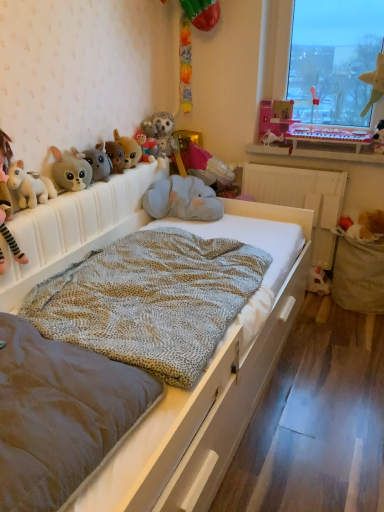
Question: From a real-world perspective, is matte plush rabbit at left, marked as the twelfth toy in a right-to-left arrangement, on top of brown plush toy at right, which appears as the twelfth toy when viewed from the left?

Choices:
 (A) yes
 (B) no

Answer: (A)

Question: Can you see matte plush rabbit at left, marked as the twelfth toy in a right-to-left arrangement, touching brown plush toy at right, which appears as the twelfth toy when viewed from the left?

Choices:
 (A) no
 (B) yes

Answer: (A)

Question: Is brown plush toy at right, the 2th toy viewed from the right, at the back of matte plush rabbit at left, arranged as the 2th toy when viewed from the left?

Choices:
 (A) yes
 (B) no

Answer: (B)

Question: Is matte plush rabbit at left, arranged as the 2th toy when viewed from the left, taller than brown plush toy at right, the 2th toy viewed from the right?

Choices:
 (A) yes
 (B) no

Answer: (A)

Question: From the image's perspective, would you say matte plush rabbit at left, arranged as the 2th toy when viewed from the left, is shown under brown plush toy at right, which appears as the twelfth toy when viewed from the left?

Choices:
 (A) no
 (B) yes

Answer: (A)

Question: Is point (160, 117) positioned closer to the camera than point (31, 329)?

Choices:
 (A) closer
 (B) farther

Answer: (B)

Question: In the image, is fluffy gray owl at center, acting as the 8th toy starting from the right, positioned in front of or behind velvet grey mattress at center?

Choices:
 (A) front
 (B) behind

Answer: (B)

Question: Based on their positions, is fluffy gray owl at center, which is counted as the 6th toy, starting from the left, located to the left or right of velvet grey mattress at center?

Choices:
 (A) left
 (B) right

Answer: (B)

Question: Based on their sizes in the image, would you say fluffy gray owl at center, acting as the 8th toy starting from the right, is bigger or smaller than velvet grey mattress at center?

Choices:
 (A) small
 (B) big

Answer: (A)

Question: Does point (8, 173) appear closer or farther from the camera than point (29, 503)?

Choices:
 (A) farther
 (B) closer

Answer: (A)

Question: Is white plush unicorn at left, which is the 1th toy from left to right, in front of or behind velvet grey mattress at center in the image?

Choices:
 (A) front
 (B) behind

Answer: (B)

Question: From the image's perspective, is white plush unicorn at left, the thirteenth toy from the right, positioned above or below velvet grey mattress at center?

Choices:
 (A) above
 (B) below

Answer: (A)

Question: Is white plush unicorn at left, the thirteenth toy from the right, taller or shorter than velvet grey mattress at center?

Choices:
 (A) short
 (B) tall

Answer: (B)

Question: From the image's perspective, is fluffy gray owl at center, acting as the 8th toy starting from the right, positioned above or below fluffy gray plush at upper left, the 3th toy in the left-to-right sequence?

Choices:
 (A) above
 (B) below

Answer: (A)

Question: Is fluffy gray owl at center, which is counted as the 6th toy, starting from the left, in front of or behind fluffy gray plush at upper left, the 3th toy in the left-to-right sequence, in the image?

Choices:
 (A) front
 (B) behind

Answer: (B)